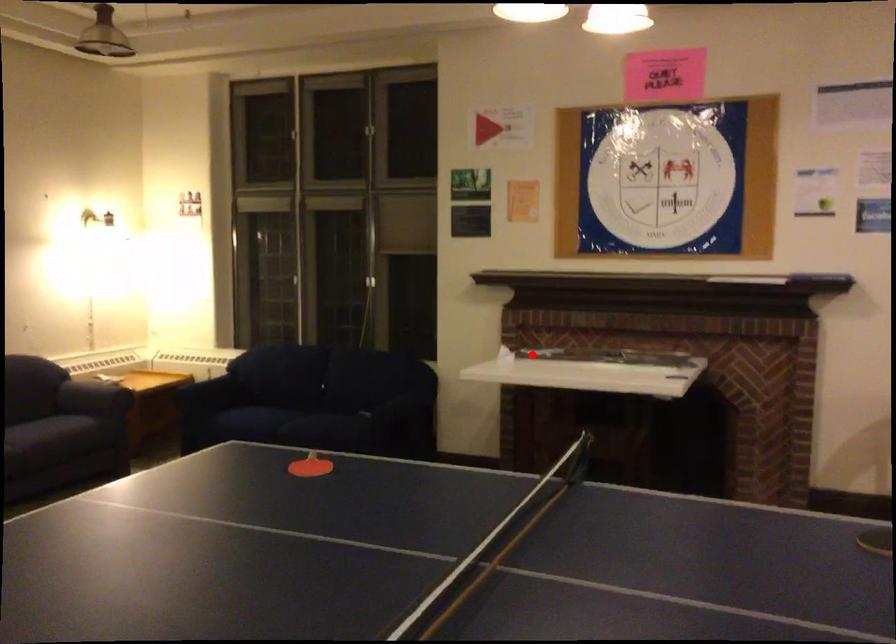
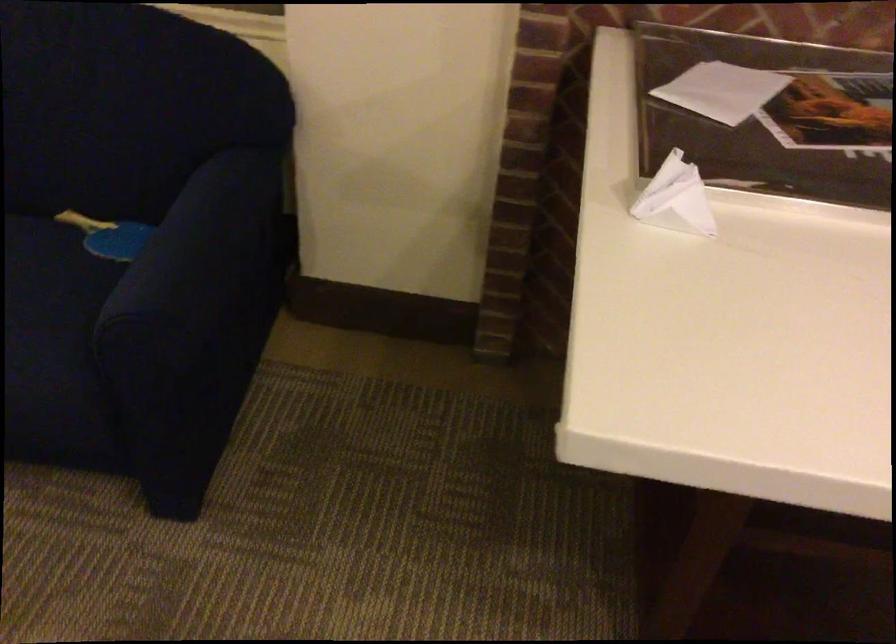
Locate, in the second image, the point that corresponds to the highlighted location in the first image.

(675, 199)